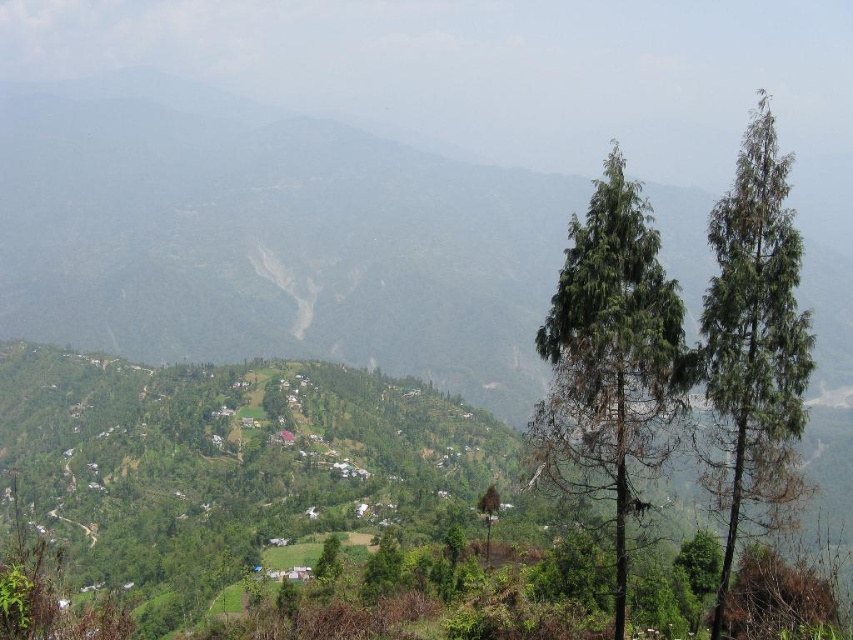
Who is positioned more to the right, green leafy mountain at center or green matte tree at right?

green matte tree at right is more to the right.

Who is taller, green leafy mountain at center or green matte tree at right?

green leafy mountain at center

Image resolution: width=853 pixels, height=640 pixels. Identify the location of green leafy mountain at center. (268, 237).

You are a GUI agent. You are given a task and a screenshot of the screen. Output one action in this format:
    pyautogui.click(x=<x>, y=<y>)
    Task: Click on the green leafy mountain at center
    The height and width of the screenshot is (640, 853).
    Given the screenshot: What is the action you would take?
    pyautogui.click(x=268, y=237)

Does point (822, 314) come closer to viewer compared to point (624, 438)?

No, (822, 314) is behind (624, 438).

Locate an element on the screen. The image size is (853, 640). green leafy mountain at center is located at coordinates (268, 237).

Does green needle-like tree at right have a greater width compared to green matte tree at right?

In fact, green needle-like tree at right might be narrower than green matte tree at right.

Who is shorter, green needle-like tree at right or green matte tree at right?

Standing shorter between the two is green needle-like tree at right.

Identify the location of green needle-like tree at right. Image resolution: width=853 pixels, height=640 pixels. (611, 358).